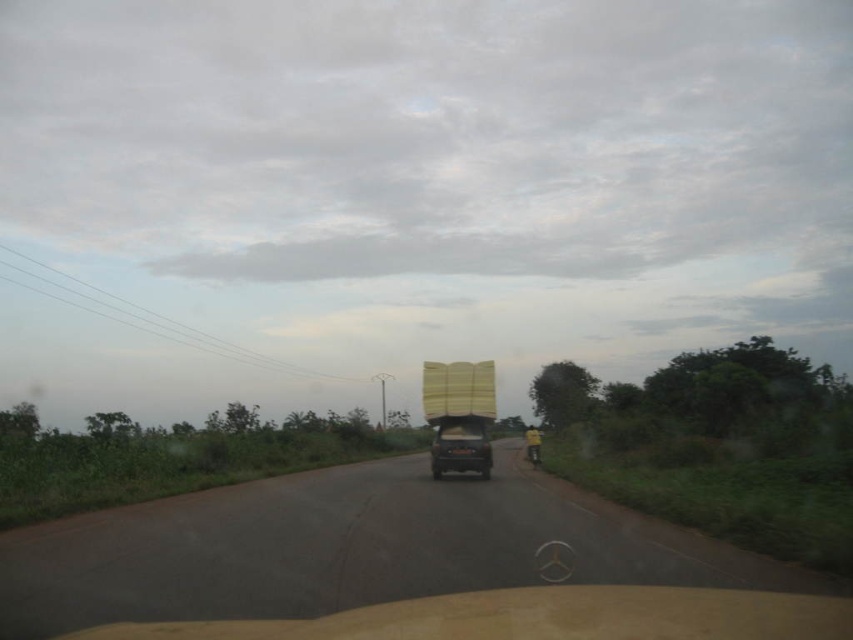
Question: Observing the image, what is the correct spatial positioning of asphalt road at center in reference to wooden planks at center?

Choices:
 (A) left
 (B) right

Answer: (A)

Question: Is wooden planks at center further to the viewer compared to matte black truck at center?

Choices:
 (A) no
 (B) yes

Answer: (B)

Question: Estimate the real-world distances between objects in this image. Which object is closer to the matte black truck at center?

Choices:
 (A) asphalt road at center
 (B) wooden planks at center

Answer: (B)

Question: Does asphalt road at center come in front of matte black truck at center?

Choices:
 (A) no
 (B) yes

Answer: (B)

Question: Among these points, which one is nearest to the camera?

Choices:
 (A) (488, 436)
 (B) (456, 564)

Answer: (B)

Question: Among these points, which one is nearest to the camera?

Choices:
 (A) (532, 545)
 (B) (451, 465)
 (C) (440, 394)

Answer: (A)